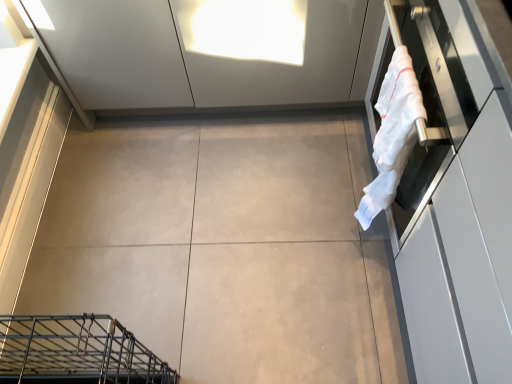
Question: Is gray matte concrete at center positioned behind white cotton towel at right?

Choices:
 (A) yes
 (B) no

Answer: (A)

Question: Is gray matte concrete at center touching white cotton towel at right?

Choices:
 (A) no
 (B) yes

Answer: (A)

Question: From a real-world perspective, is gray matte concrete at center over white cotton towel at right?

Choices:
 (A) yes
 (B) no

Answer: (B)

Question: Is gray matte concrete at center smaller than white cotton towel at right?

Choices:
 (A) no
 (B) yes

Answer: (A)

Question: Is gray matte concrete at center outside white cotton towel at right?

Choices:
 (A) yes
 (B) no

Answer: (A)

Question: Can you confirm if gray matte concrete at center is thinner than white cotton towel at right?

Choices:
 (A) no
 (B) yes

Answer: (A)

Question: Is there a large distance between white cotton towel at right and gray matte concrete at center?

Choices:
 (A) no
 (B) yes

Answer: (A)

Question: Does white cotton towel at right have a lesser width compared to gray matte concrete at center?

Choices:
 (A) no
 (B) yes

Answer: (B)

Question: Is white cotton towel at right to the right of gray matte concrete at center from the viewer's perspective?

Choices:
 (A) no
 (B) yes

Answer: (B)

Question: From the image's perspective, is white cotton towel at right on gray matte concrete at center?

Choices:
 (A) yes
 (B) no

Answer: (A)

Question: Can you see white cotton towel at right touching gray matte concrete at center?

Choices:
 (A) no
 (B) yes

Answer: (A)

Question: Is white cotton towel at right turned away from gray matte concrete at center?

Choices:
 (A) yes
 (B) no

Answer: (B)

Question: Is white glossy oven at right closer to the viewer compared to white cotton towel at right?

Choices:
 (A) no
 (B) yes

Answer: (B)